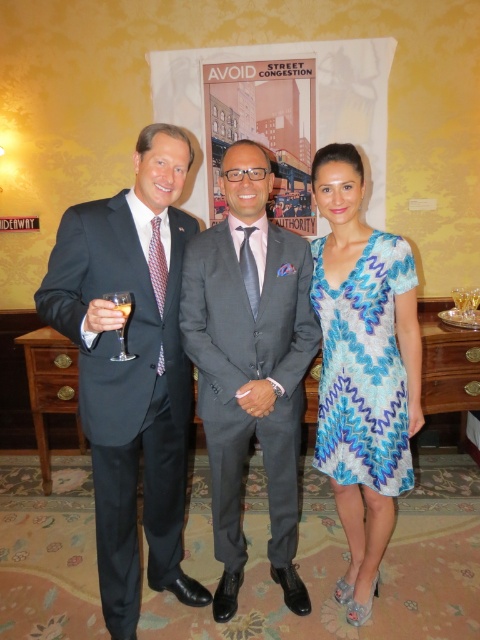
Question: Among these points, which one is farthest from the camera?

Choices:
 (A) (73, 228)
 (B) (377, 499)
 (C) (326, 148)

Answer: (B)

Question: Is matte black suit at center thinner than matte black suit at left?

Choices:
 (A) yes
 (B) no

Answer: (B)

Question: Which point is farther to the camera?

Choices:
 (A) (115, 294)
 (B) (156, 413)
 (C) (129, 268)

Answer: (B)

Question: Is matte black suit at center behind gray suit at center?

Choices:
 (A) no
 (B) yes

Answer: (A)

Question: Based on their relative distances, which object is nearer to the clear glass wine glass at left?

Choices:
 (A) blue printed dress at center
 (B) matte black suit at center
 (C) blue lace dress at center
 (D) matte black suit at left

Answer: (D)

Question: Is matte black suit at left behind blue printed dress at center?

Choices:
 (A) yes
 (B) no

Answer: (B)